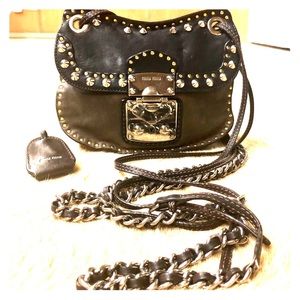
Where is `floor to left of purse`? floor to left of purse is located at coordinates (32, 103).